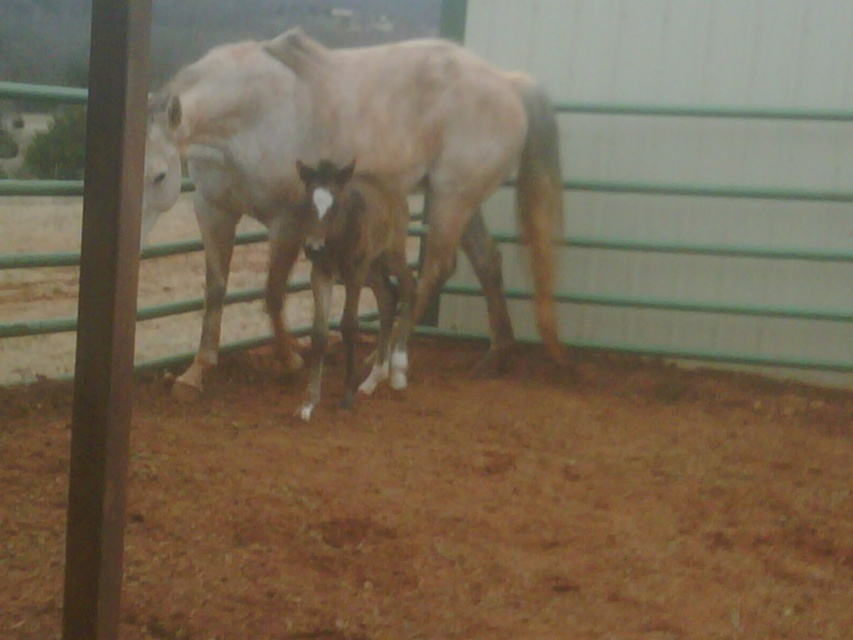
You are a photographer standing at the origin point of the coordinate system. You want to take a photo of the white matte horse at center. What are the coordinates you should aim your camera at?

The coordinates you should aim your camera at are point (357, 161), as that is the 2D location of the white matte horse at center.

You are a farmer who needs to separate the two horses into two different stalls. The white matte horse at center requires a stall with a height of at least 2 meters to accommodate its size. Can the dark brown glossy horse at center fit into a stall that is only 1.5 meters tall?

The white matte horse at center is larger than the dark brown glossy horse at center. Since the dark brown glossy horse at center is smaller, it can fit into a 1.5 meter tall stall.